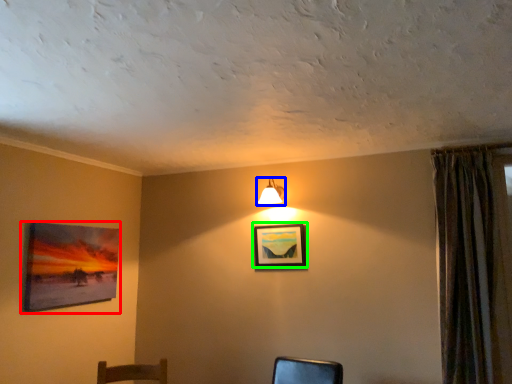
Question: Which object is the closest to the picture frame (highlighted by a red box)? Choose among these: lamp (highlighted by a blue box) or picture frame (highlighted by a green box).

Choices:
 (A) lamp
 (B) picture frame

Answer: (B)